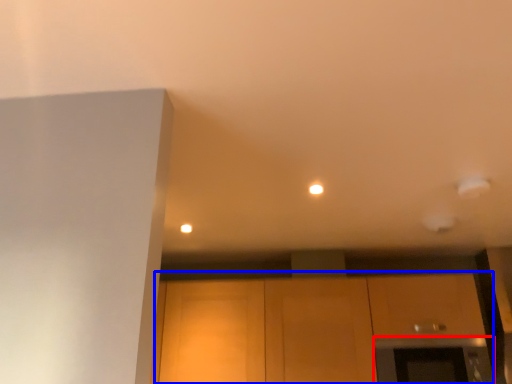
Question: Which point is further to the camera, oven (highlighted by a red box) or cabinetry (highlighted by a blue box)?

Choices:
 (A) oven
 (B) cabinetry

Answer: (B)